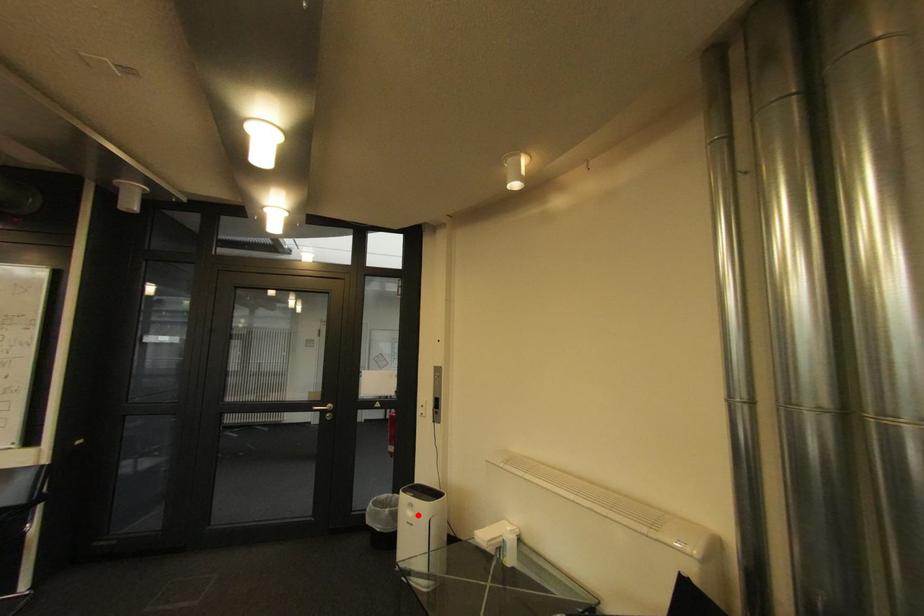
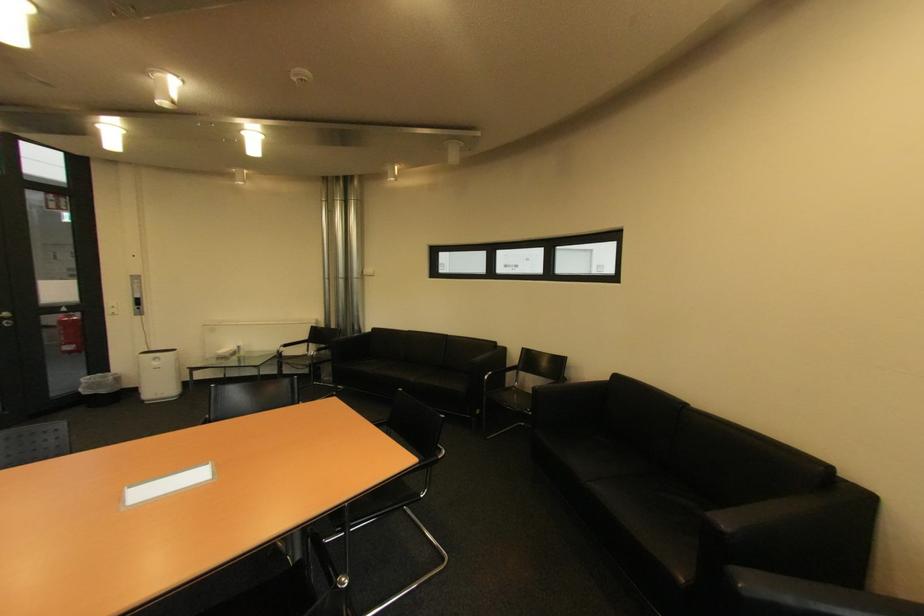
Question: I am providing you with two images of the same scene from different viewpoints. A red point is shown in image1. For the corresponding object point in image2, is it positioned nearer or farther from the camera?

Choices:
 (A) Nearer
 (B) Farther

Answer: (A)